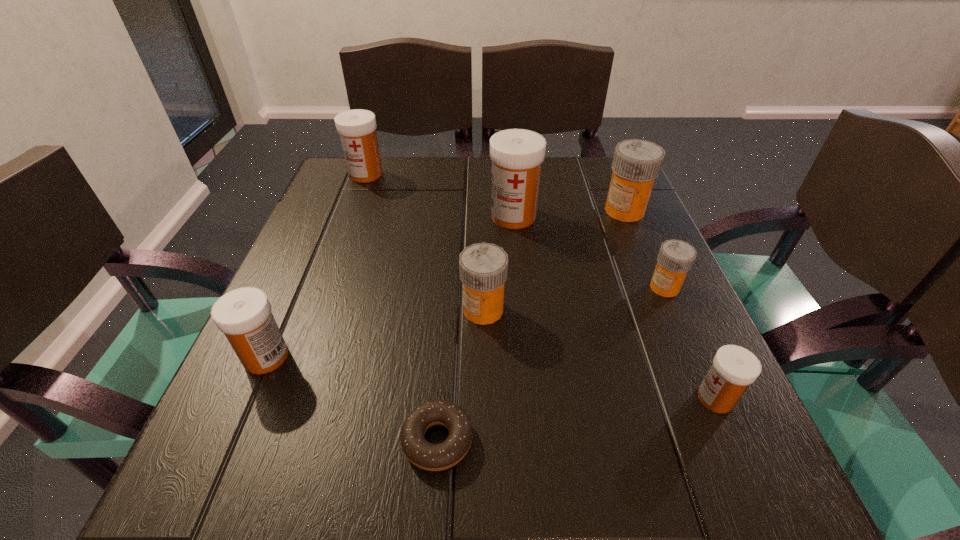
Identify the location of vacant space located 0.060m on the label side of the second biggest orange medicine. (427, 309).

Locate an element on the screen. This screenshot has width=960, height=540. free space located 0.160m on the back of the third biggest white medicine is located at coordinates (302, 274).

Identify the location of free space located 0.250m on the label side of the smallest orange medicine. (515, 287).

Find the location of a particular element. This screenshot has height=540, width=960. vacant space situated on the label side of the smallest orange medicine is located at coordinates (483, 287).

The height and width of the screenshot is (540, 960). What are the coordinates of `vacant area situated 0.170m on the label side of the smallest orange medicine` in the screenshot? It's located at (558, 287).

This screenshot has height=540, width=960. What are the coordinates of `vacant space situated 0.060m on the back of the smallest white medicine` in the screenshot? It's located at (694, 350).

The width and height of the screenshot is (960, 540). I want to click on vacant space located 0.270m on the right of the doughnut, so click(x=670, y=440).

The height and width of the screenshot is (540, 960). I want to click on object located at the near edge, so click(x=432, y=457).

Identify the location of object located at the far left corner. (357, 128).

Identify the location of object at the far right corner. This screenshot has width=960, height=540. (636, 163).